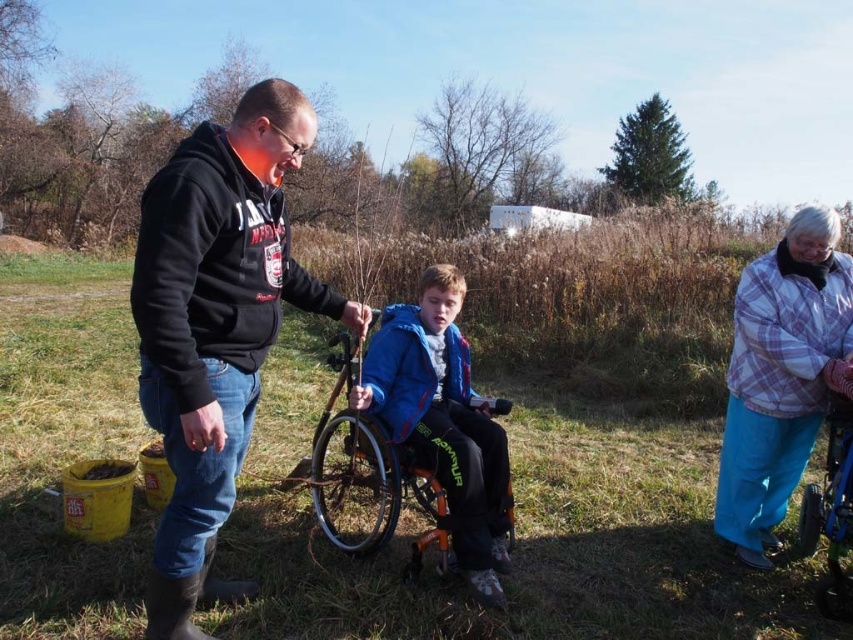
You are a photographer trying to capture a candid shot of the scene. You have a camera lens that can only focus on objects within a 30cm range. The black matte hoodie at center and the orange metallic wheelchair at center are your subjects. Which subject should you aim your camera at to ensure both are in focus?

The black matte hoodie at center is to the left of orange metallic wheelchair at center, so aim the camera at the midpoint between them to ensure both are within the 30cm focus range.